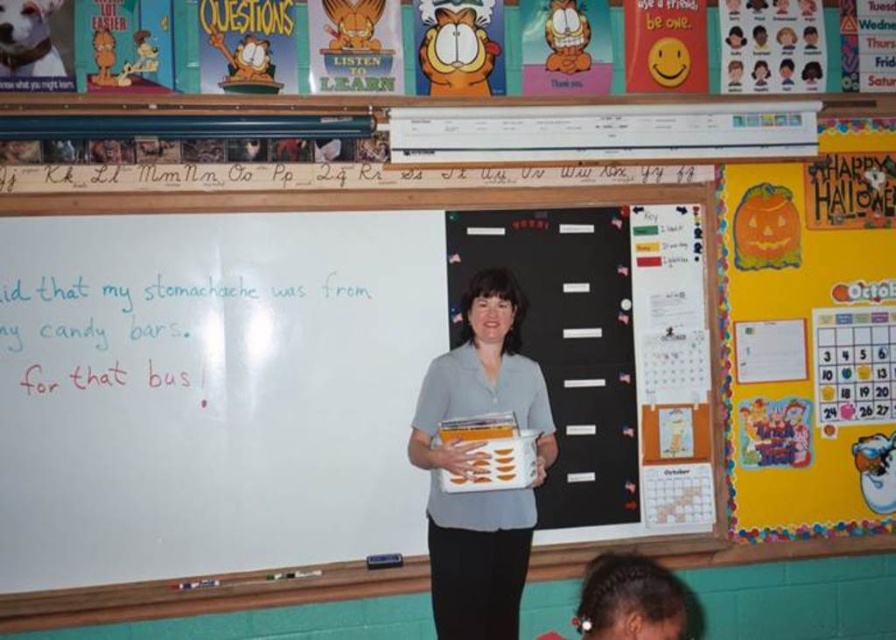
Question: Which point is closer to the camera?

Choices:
 (A) (432, 500)
 (B) (186, 540)

Answer: (A)

Question: Is yellow paper calendar at upper right smaller than gray fabric shirt at center?

Choices:
 (A) yes
 (B) no

Answer: (B)

Question: Does yellow paper calendar at upper right lie behind gray fabric shirt at center?

Choices:
 (A) no
 (B) yes

Answer: (B)

Question: Is yellow paper calendar at upper right closer to camera compared to gray fabric shirt at center?

Choices:
 (A) yes
 (B) no

Answer: (B)